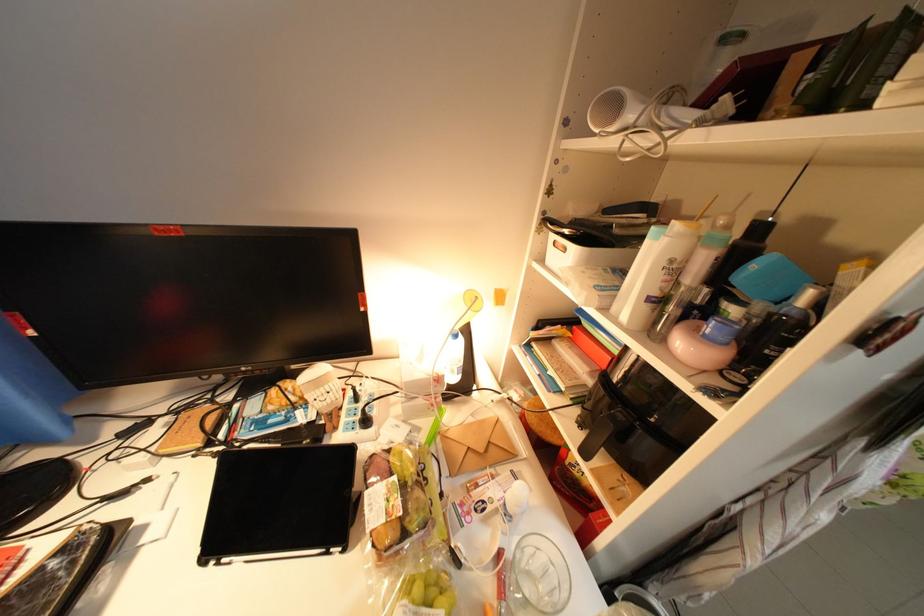
Describe the element at coordinates (396, 496) in the screenshot. I see `the packaged pastry` at that location.